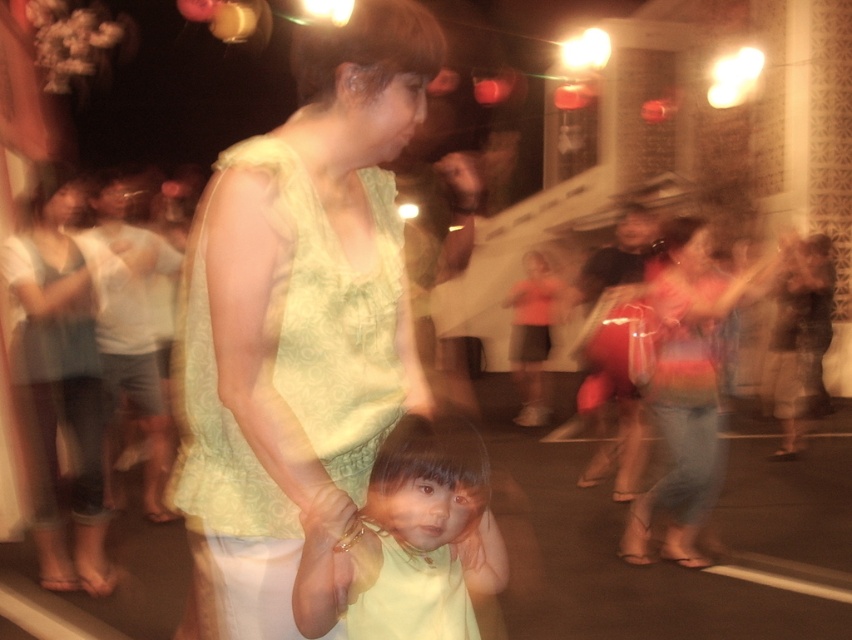
In the scene shown: Between light green fabric at center and light yellow fabric at center, which one has more height?

With more height is light green fabric at center.

Which is more to the right, light green fabric at center or light yellow fabric at center?

Positioned to the right is light yellow fabric at center.

What do you see at coordinates (297, 314) in the screenshot? I see `light green fabric at center` at bounding box center [297, 314].

The height and width of the screenshot is (640, 852). What are the coordinates of `light green fabric at center` in the screenshot? It's located at [297, 314].